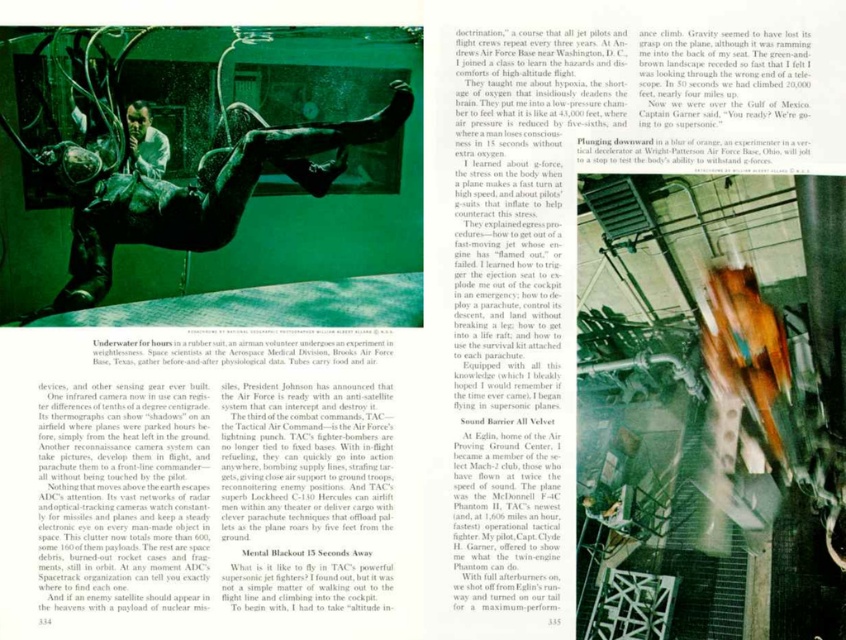
You are designing a poster and need to ensure that the green matte man at center and the matte black helmet at upper center are proportionally sized. According to the image, which object should be made smaller in the poster to maintain the correct proportions?

The green matte man at center has a lesser height compared to the matte black helmet at upper center, so to maintain correct proportions, the green matte man at center should be made smaller than the matte black helmet at upper center.

Based on the scene description, where is the green matte man at center located in terms of coordinates?

The green matte man at center is located at coordinates point (205, 196).

You are designing a layout for a magazine page. You have a green matte man at center and a matte black helmet at upper center. Based on their sizes, which object should you place closer to the edge of the page to maintain visual balance?

The green matte man at center has a smaller size compared to the matte black helmet at upper center. To maintain visual balance, the larger matte black helmet at upper center should be placed closer to the edge of the page since larger objects are typically positioned further inward for balance, but since it is larger, moving it outward might help balance with the smaller man. Wait, actually, visual balance often requires that larger objects be placed farther from the center to balance with smaller ones. So